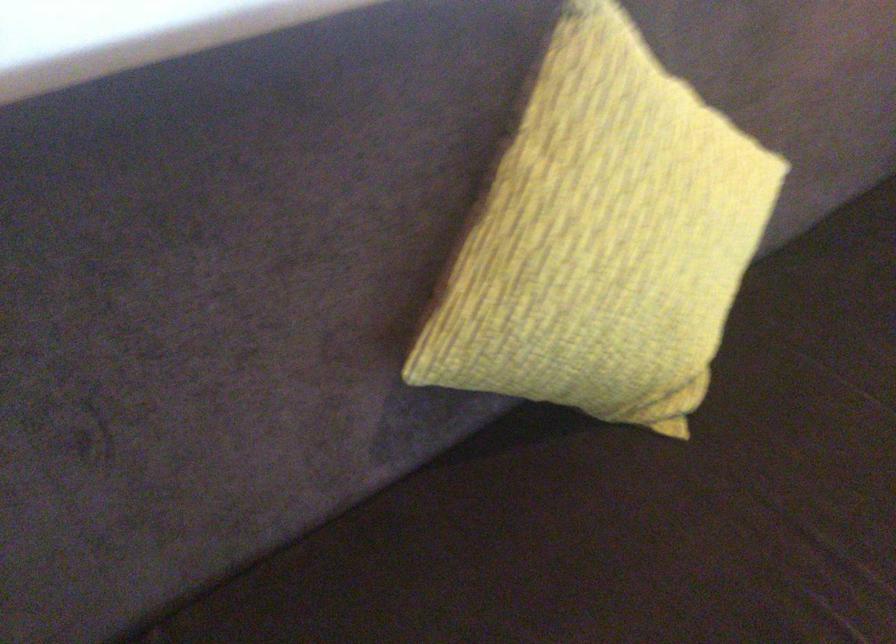
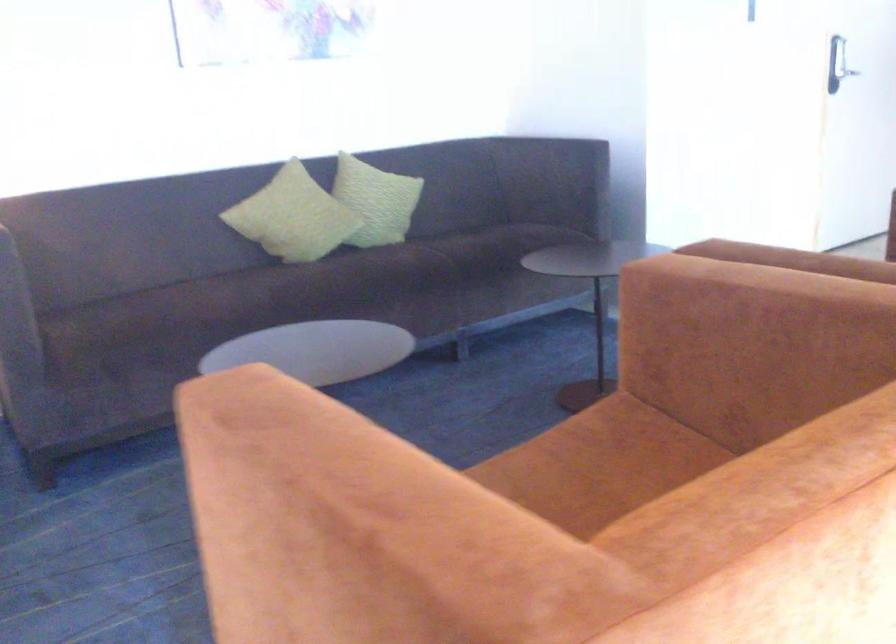
Question: The images are taken continuously from a first-person perspective. In which direction are you moving?

Choices:
 (A) Left
 (B) Right
 (C) Forward
 (D) Backward

Answer: (B)